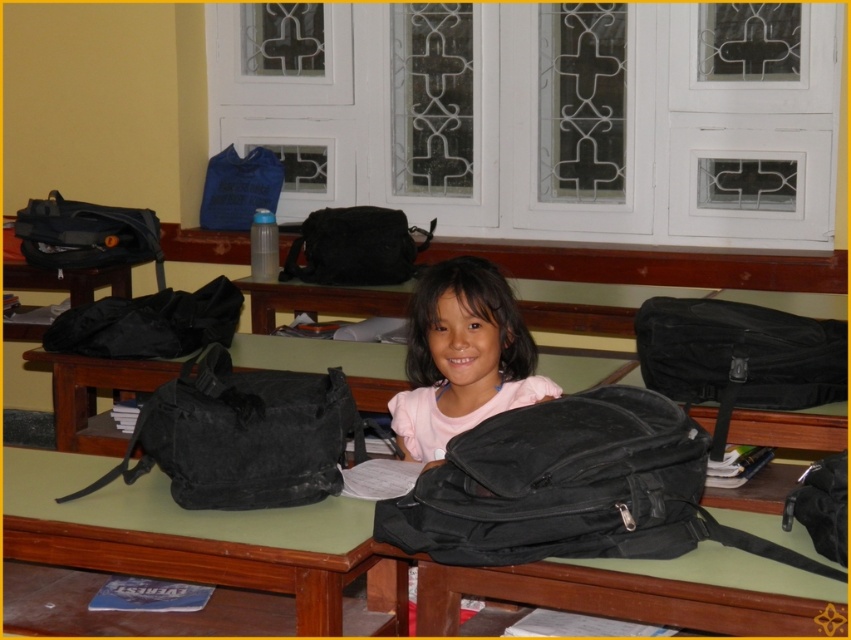
Question: Is black canvas duffel at left in front of matte black duffel bag at left?

Choices:
 (A) yes
 (B) no

Answer: (A)

Question: Considering the relative positions of black fabric backpack at center and matte black bag at center in the image provided, where is black fabric backpack at center located with respect to matte black bag at center?

Choices:
 (A) right
 (B) left

Answer: (A)

Question: Which object is positioned closest to the matte black bag at center?

Choices:
 (A) pink matte backpack at center
 (B) black fabric backpack at center

Answer: (A)

Question: Among these objects, which one is nearest to the camera?

Choices:
 (A) matte black duffel bag at left
 (B) matte black bag at center
 (C) black matte backpack at center

Answer: (C)

Question: Can you confirm if pink matte backpack at center is positioned to the right of black fabric bag at left?

Choices:
 (A) yes
 (B) no

Answer: (A)

Question: Which point appears closest to the camera in this image?

Choices:
 (A) (335, 276)
 (B) (687, 426)

Answer: (B)